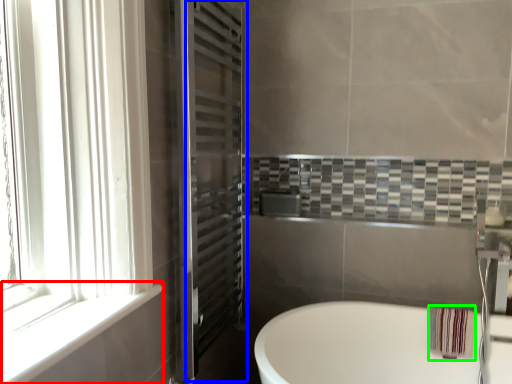
Question: Which is nearer to the window sill (highlighted by a red box)? screen door (highlighted by a blue box) or material (highlighted by a green box).

Choices:
 (A) screen door
 (B) material

Answer: (A)